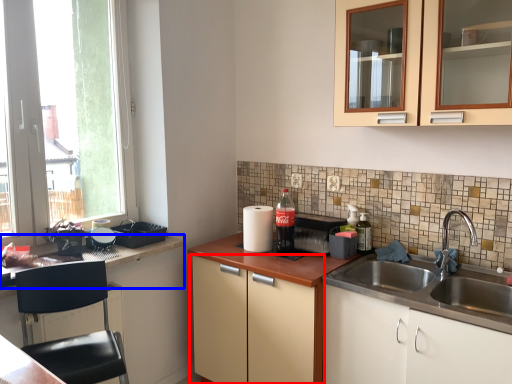
Question: Which of the following is the closest to the observer, cabinetry (highlighted by a red box) or countertop (highlighted by a blue box)?

Choices:
 (A) cabinetry
 (B) countertop

Answer: (B)